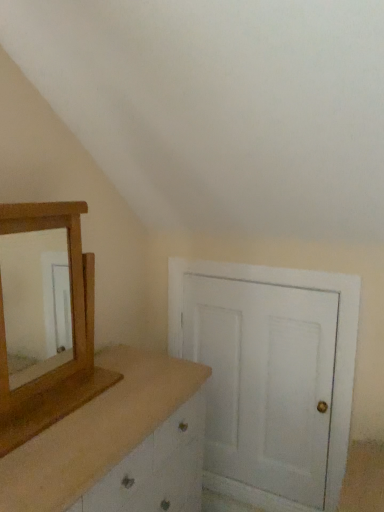
Question: Is wooden mirror at left at the right side of white matte door at center?

Choices:
 (A) no
 (B) yes

Answer: (A)

Question: From a real-world perspective, is wooden mirror at left located higher than white matte door at center?

Choices:
 (A) yes
 (B) no

Answer: (A)

Question: Is wooden mirror at left shorter than white matte door at center?

Choices:
 (A) yes
 (B) no

Answer: (A)

Question: Considering the relative positions of wooden mirror at left and white matte door at center in the image provided, is wooden mirror at left to the left of white matte door at center from the viewer's perspective?

Choices:
 (A) yes
 (B) no

Answer: (A)

Question: Is the position of wooden mirror at left less distant than that of white matte door at center?

Choices:
 (A) yes
 (B) no

Answer: (A)

Question: Visually, is wooden dresser at left positioned to the left or to the right of white matte door at center?

Choices:
 (A) left
 (B) right

Answer: (A)

Question: Choose the correct answer: Is wooden dresser at left inside white matte door at center or outside it?

Choices:
 (A) inside
 (B) outside

Answer: (B)

Question: Looking at the image, does wooden dresser at left seem bigger or smaller compared to white matte door at center?

Choices:
 (A) small
 (B) big

Answer: (B)

Question: Considering the positions of wooden dresser at left and white matte door at center in the image, is wooden dresser at left wider or thinner than white matte door at center?

Choices:
 (A) wide
 (B) thin

Answer: (A)

Question: Does point (66, 367) appear closer or farther from the camera than point (274, 407)?

Choices:
 (A) closer
 (B) farther

Answer: (A)

Question: From the image's perspective, relative to white matte door at center, is wooden mirror at left above or below?

Choices:
 (A) below
 (B) above

Answer: (B)

Question: Do you think wooden mirror at left is within white matte door at center, or outside of it?

Choices:
 (A) outside
 (B) inside

Answer: (A)

Question: From a real-world perspective, is wooden mirror at left positioned above or below white matte door at center?

Choices:
 (A) below
 (B) above

Answer: (B)

Question: From a real-world perspective, relative to wooden dresser at left, is wooden mirror at left vertically above or below?

Choices:
 (A) below
 (B) above

Answer: (B)

Question: Visually, is wooden mirror at left positioned to the left or to the right of wooden dresser at left?

Choices:
 (A) right
 (B) left

Answer: (B)